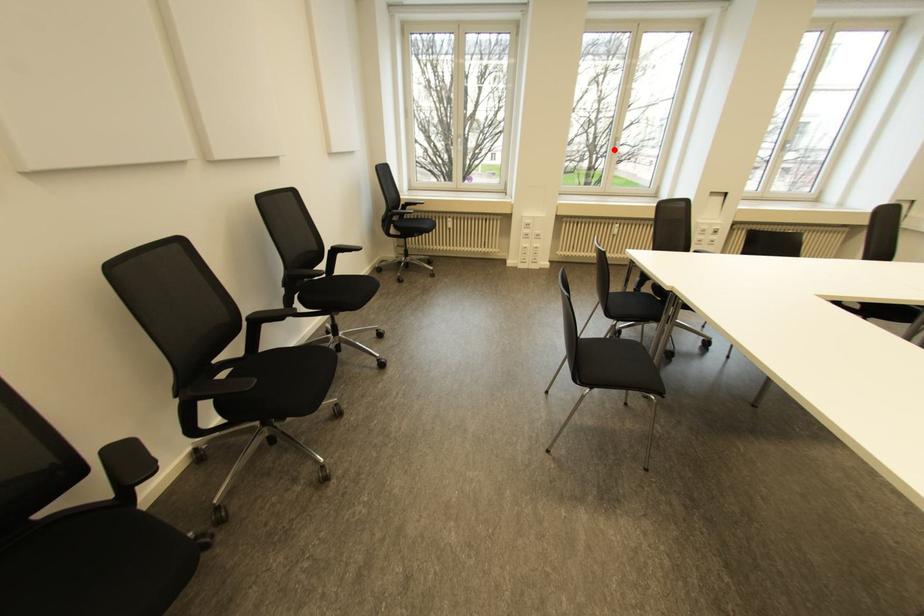
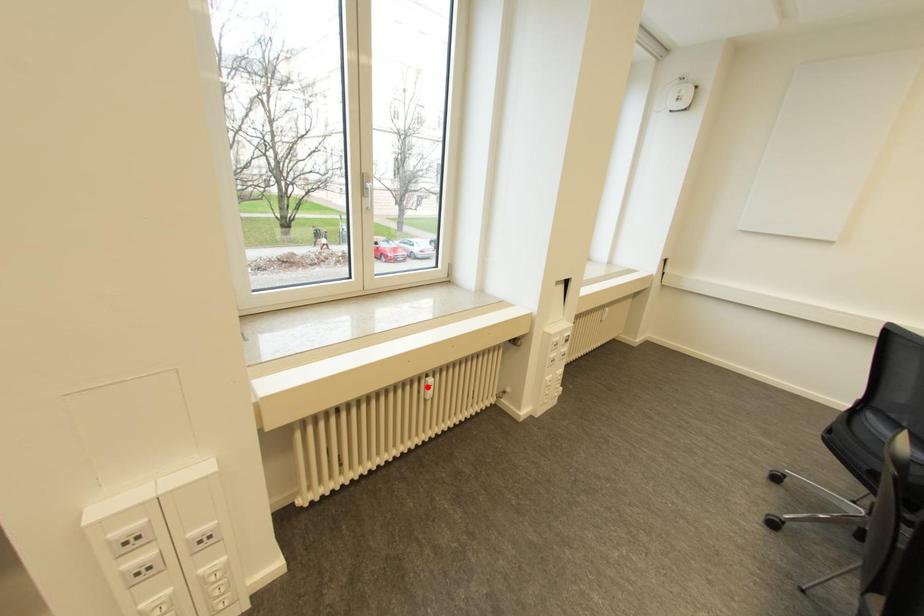
I am providing you with two images of the same scene from different viewpoints. A red point is marked on the first image and another point is marked on the second image. Do the highlighted points in image1 and image2 indicate the same real-world spot?

No